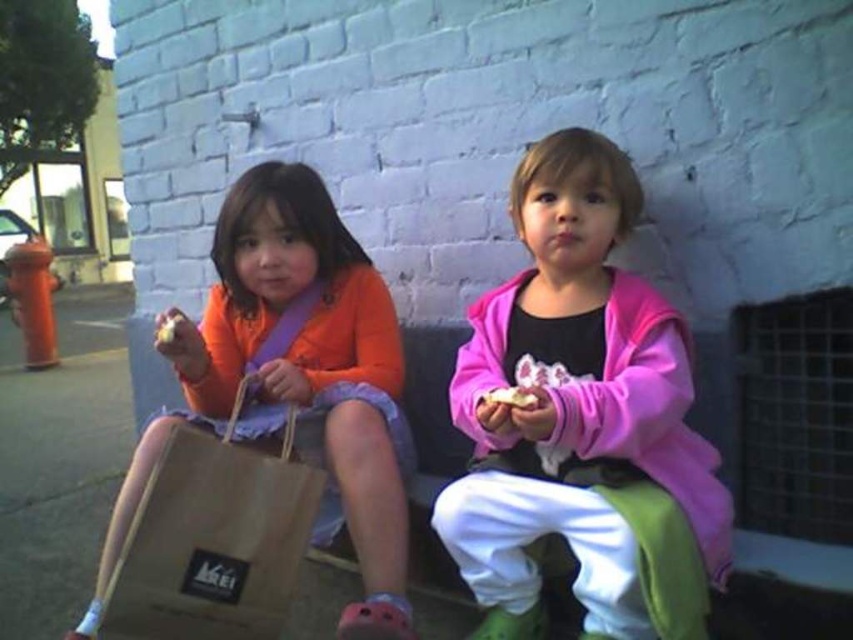
You are a delivery person who needs to place a small package on the bench where the two children are sitting. The package must be placed above the white crumbly food at center. Can you place the package on the bench without moving the matte brown paper bag at left?

The matte brown paper bag at left is below the white crumbly food at center, so the package can be placed above the white crumbly food at center on the bench without disturbing the paper bag.